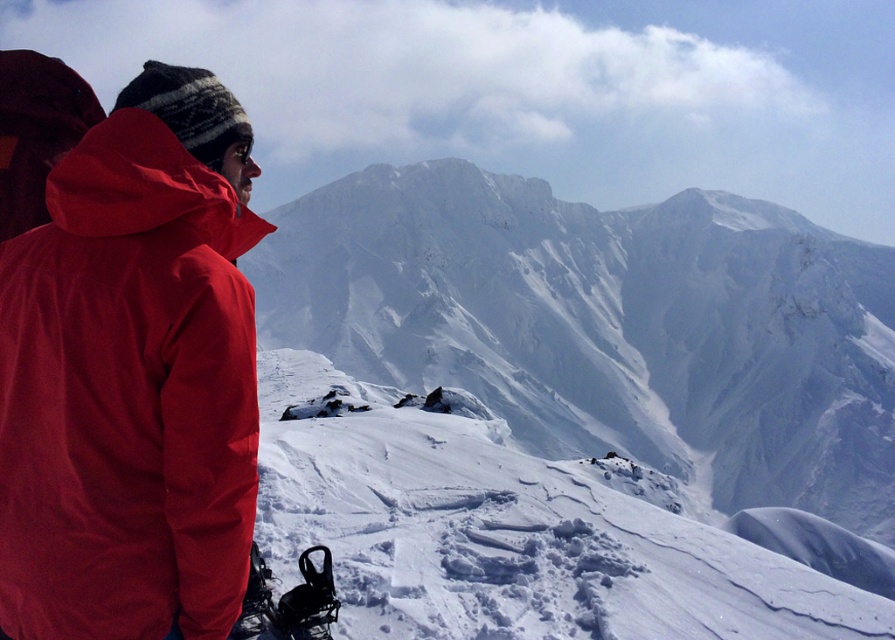
You are a photographer trying to capture the person in the matte red jacket at left against the white powdery snow at center. To ensure the jacket stands out, you want to position them so that the jacket is not hidden by the snow. Based on the scene description, where should you place the person relative to the snow?

The matte red jacket at left is positioned on the left side of white powdery snow at center. To ensure the jacket stands out, place the person so that the jacket is on the left side of the snow area, avoiding overlapping too much with the white snow.